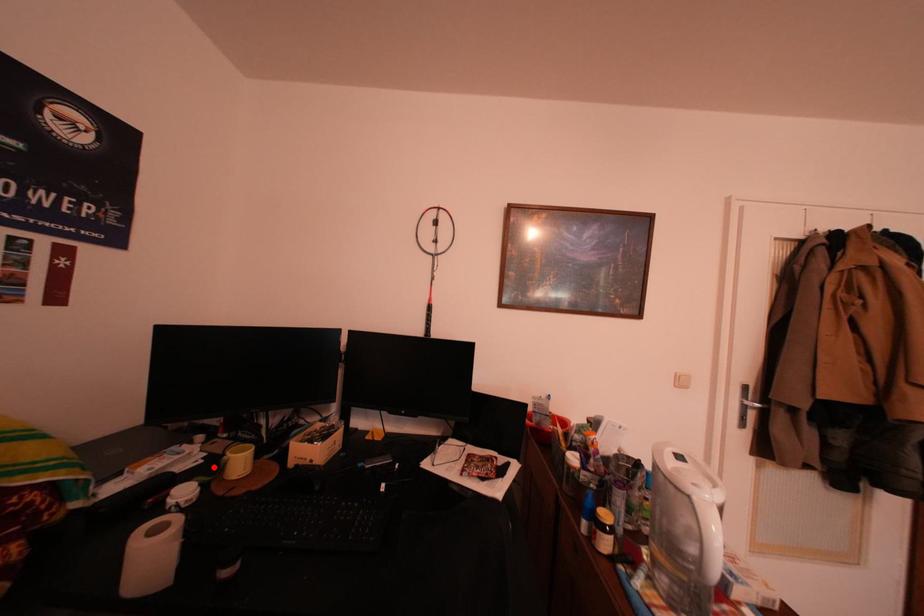
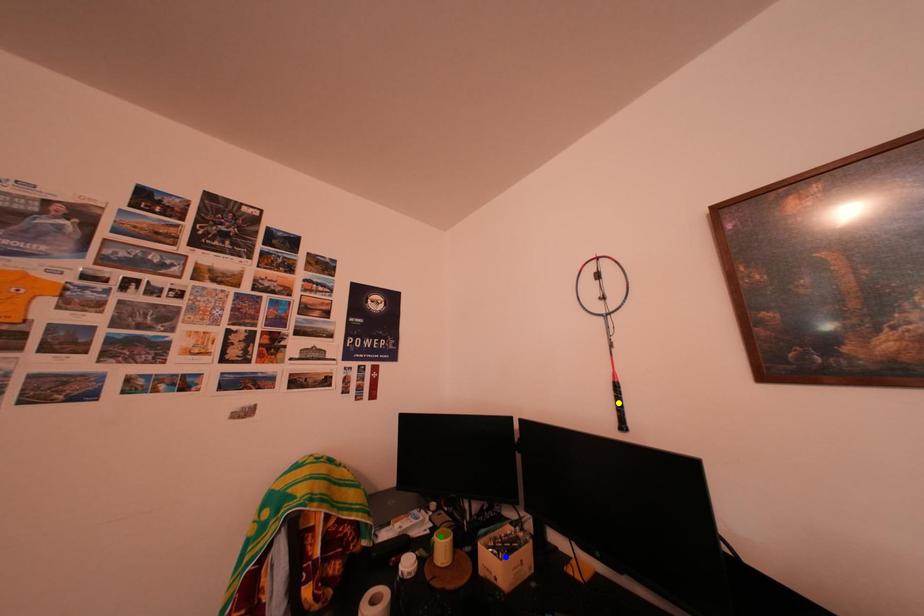
Question: I am providing you with two images of the same scene from different viewpoints. A red point is marked on the first image. You are given multiple points on the second image. Which point in image 2 is actually the same real-world point as the red point in image 1?

Choices:
 (A) green point
 (B) blue point
 (C) yellow point

Answer: (A)